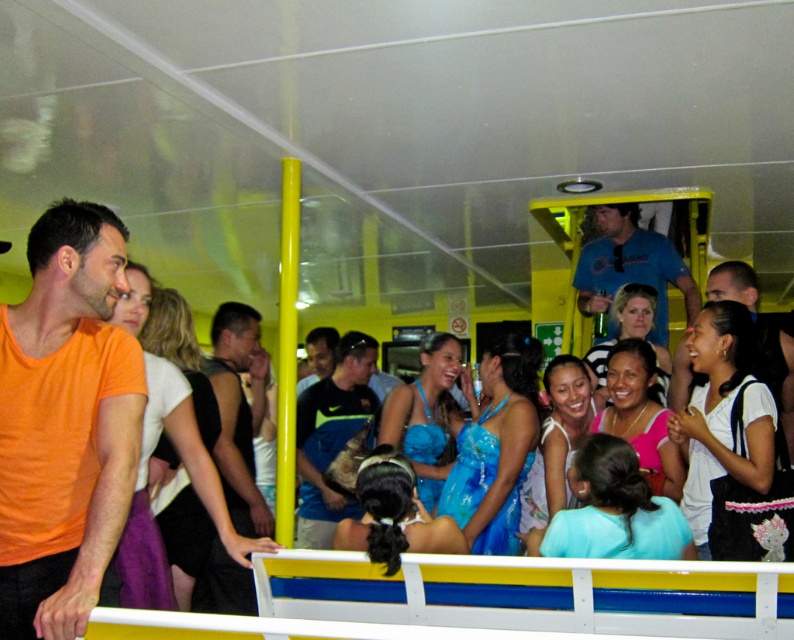
You are a passenger on a bus and want to move from the front of the bus to the back. You see two points marked on the floor, point 1 at coordinates point [110,252] and point 2 at coordinates point [326,532]. Which point should you step on first while moving from the front to the back?

Point [110,252] is in front of point [326,532], so you should step on point [110,252] first when moving from the front to the back of the bus.